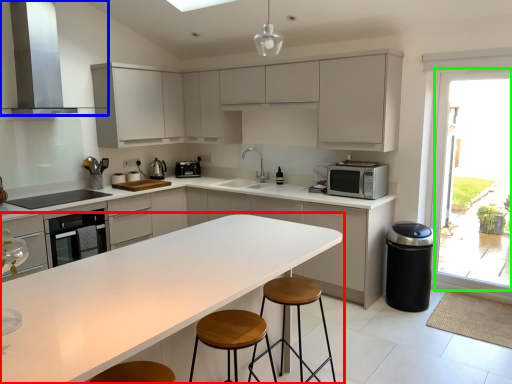
Question: Which object is the closest to the countertop (highlighted by a red box)? Choose among these: home appliance (highlighted by a blue box) or window (highlighted by a green box).

Choices:
 (A) home appliance
 (B) window

Answer: (A)